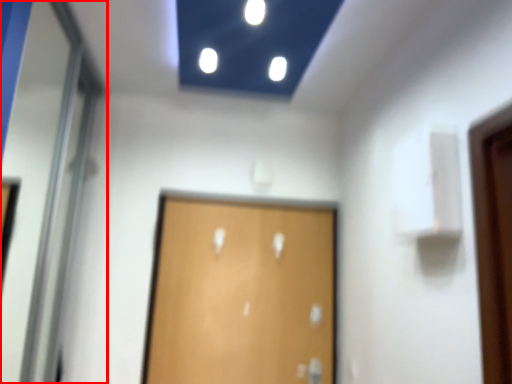
Question: Observing the image, what is the correct spatial positioning of elevator door (annotated by the red box) in reference to door?

Choices:
 (A) left
 (B) right

Answer: (A)